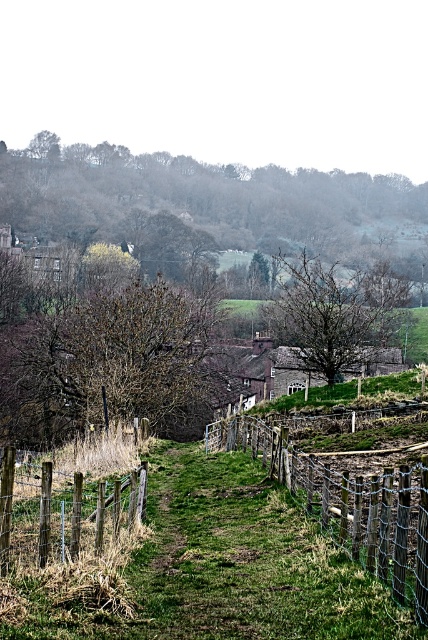
Is brown leafless tree at upper center closer to camera compared to wooden wire fence at center?

No.

Describe the element at coordinates (214, 202) in the screenshot. The image size is (428, 640). I see `brown leafless tree at upper center` at that location.

Is point (309, 179) less distant than point (265, 460)?

No, (309, 179) is further to viewer.

What are the coordinates of `brown leafless tree at upper center` in the screenshot? It's located at (214, 202).

Who is higher up, brown leafless tree at upper center or brown wooden fence at lower left?

brown leafless tree at upper center is higher up.

Is brown leafless tree at upper center thinner than brown wooden fence at lower left?

No.

At what (x,y) coordinates should I click in order to perform the action: click on brown leafless tree at upper center. Please return your answer as a coordinate pair (x, y). The height and width of the screenshot is (640, 428). Looking at the image, I should click on coord(214,202).

Where is `brown leafless tree at upper center`? Image resolution: width=428 pixels, height=640 pixels. brown leafless tree at upper center is located at coordinates (214, 202).

Which is more to the right, brown leafless tree at upper center or brown leafy tree at center?

From the viewer's perspective, brown leafless tree at upper center appears more on the right side.

Is brown leafless tree at upper center bigger than brown leafy tree at center?

Yes.

Which is in front, point (181, 172) or point (202, 355)?

Point (202, 355) is more forward.

Locate an element on the screen. The width and height of the screenshot is (428, 640). brown leafless tree at upper center is located at coordinates (214, 202).